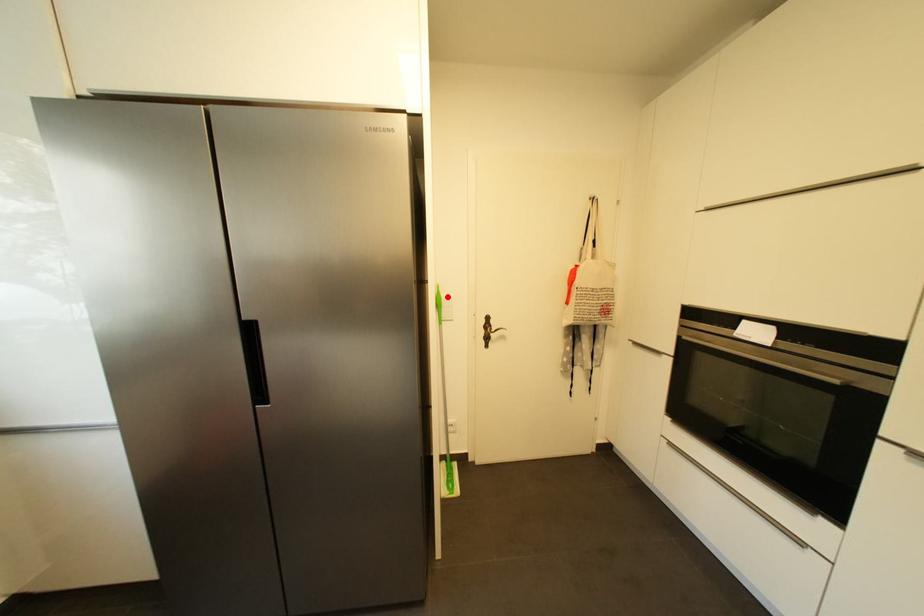
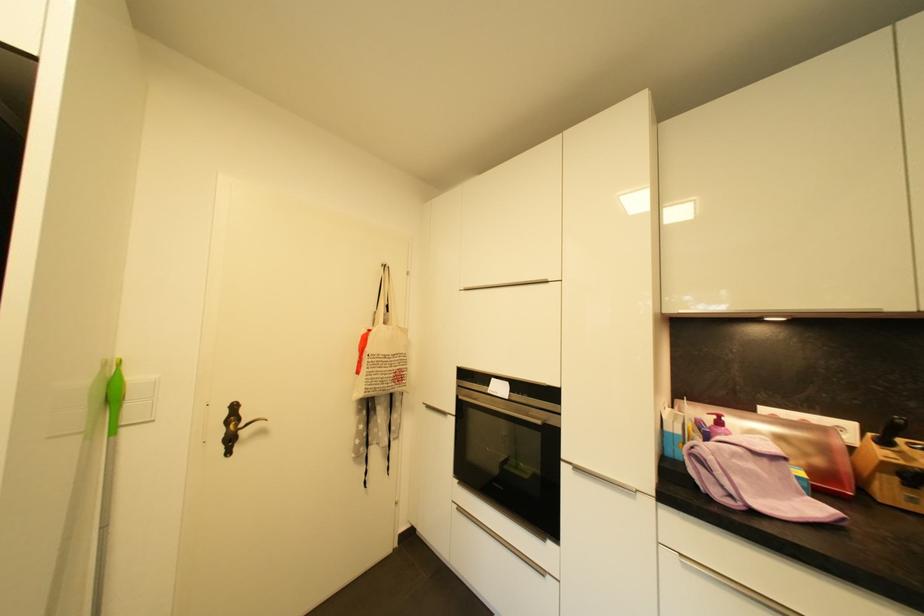
The point at the highlighted location is marked in the first image. Where is the corresponding point in the second image?

(138, 379)